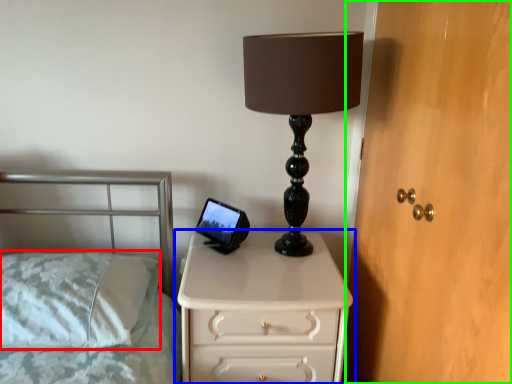
Question: Considering the real-world distances, which object is farthest from pillow (highlighted by a red box)? chest of drawers (highlighted by a blue box) or dresser (highlighted by a green box)?

Choices:
 (A) chest of drawers
 (B) dresser

Answer: (B)